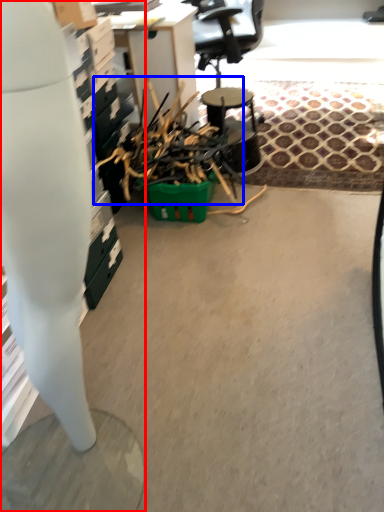
Question: Which of the following is the farthest to the observer, desk (highlighted by a red box) or debris (highlighted by a blue box)?

Choices:
 (A) desk
 (B) debris

Answer: (B)